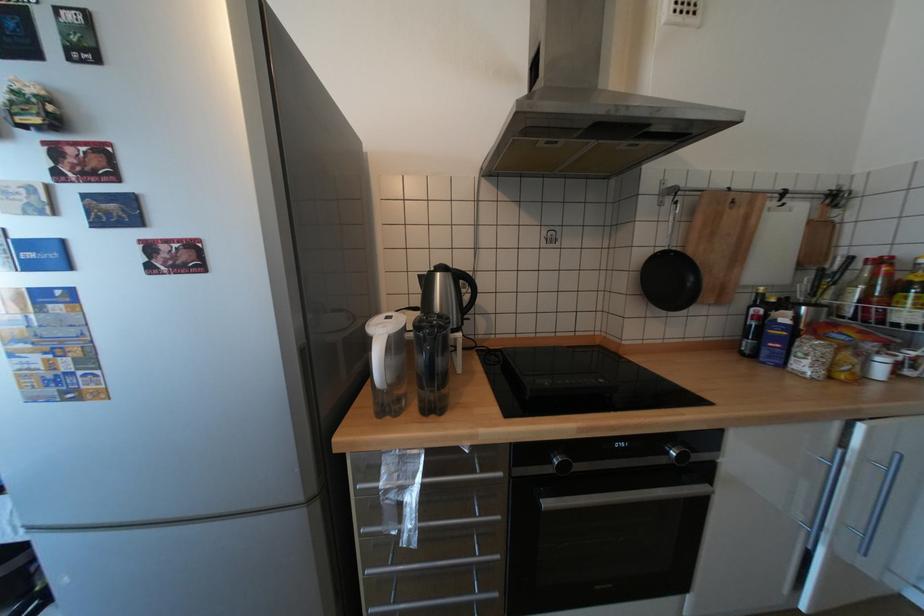
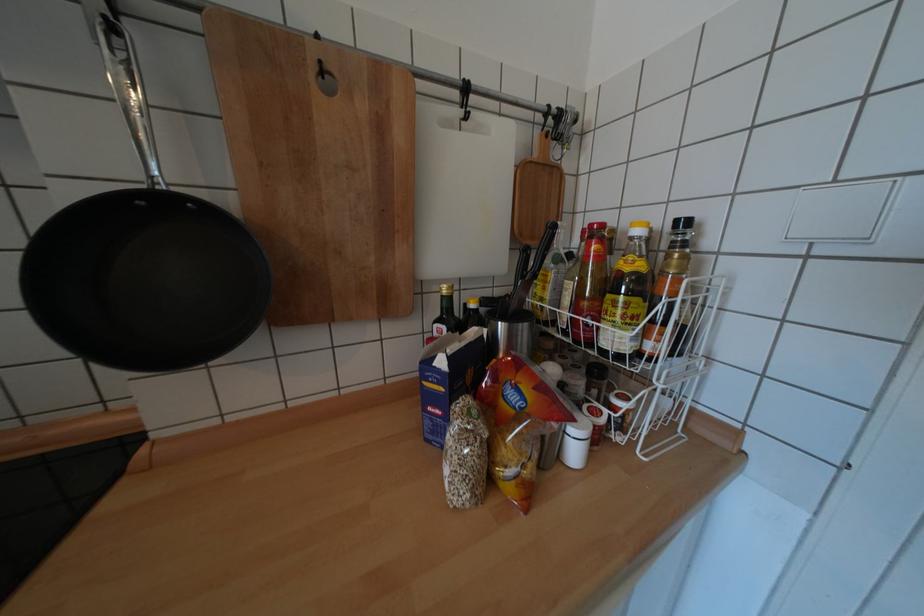
In a continuous first-person perspective shot, in which direction is the camera moving?

The cameraman moved toward right, forward.